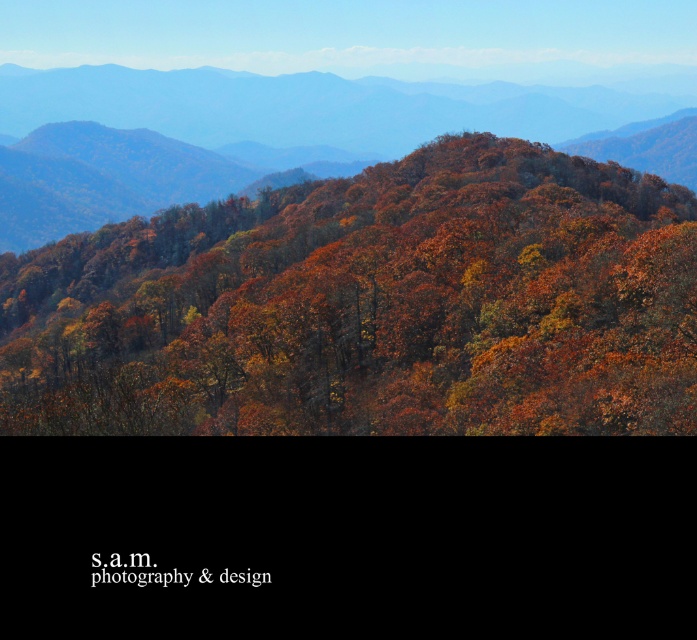
Question: Considering the relative positions of autumn leaves at center and autumn foliage at center in the image provided, where is autumn leaves at center located with respect to autumn foliage at center?

Choices:
 (A) below
 (B) above

Answer: (A)

Question: Is autumn leaves at center wider than autumn foliage at center?

Choices:
 (A) yes
 (B) no

Answer: (B)

Question: Is autumn leaves at center closer to the viewer compared to autumn foliage at center?

Choices:
 (A) no
 (B) yes

Answer: (B)

Question: Among these points, which one is farthest from the camera?

Choices:
 (A) (682, 243)
 (B) (312, 92)

Answer: (B)